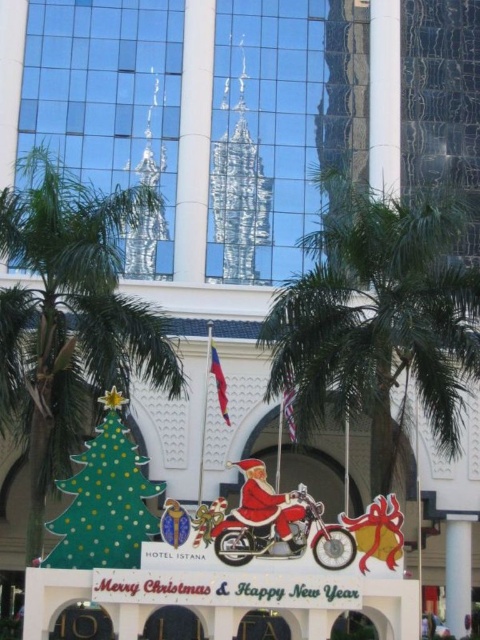
Which of these two, shiny chrome motorcycle at center or matte red santa at center, stands shorter?

With less height is matte red santa at center.

Does point (330, 545) come behind point (248, 484)?

No.

Is point (226, 536) closer to viewer compared to point (271, 499)?

Yes, point (226, 536) is in front of point (271, 499).

This screenshot has width=480, height=640. What are the coordinates of `shiny chrome motorcycle at center` in the screenshot? It's located at (279, 529).

Is the position of green leafy palm tree at center less distant than that of green polka dot cardboard christmas tree at lower left?

No.

Between green leafy palm tree at center and green polka dot cardboard christmas tree at lower left, which one is positioned higher?

Positioned higher is green leafy palm tree at center.

Find the location of a particular element. Image resolution: width=480 pixels, height=640 pixels. green leafy palm tree at center is located at coordinates (380, 317).

At what (x,y) coordinates should I click in order to perform the action: click on green leafy palm tree at center. Please return your answer as a coordinate pair (x, y). The width and height of the screenshot is (480, 640). Looking at the image, I should click on (380, 317).

Who is positioned more to the left, green leafy palm tree at left or shiny chrome motorcycle at center?

Positioned to the left is green leafy palm tree at left.

Is point (113, 275) positioned before point (230, 528)?

No, (113, 275) is further to viewer.

Where is `green leafy palm tree at left`? green leafy palm tree at left is located at coordinates (70, 316).